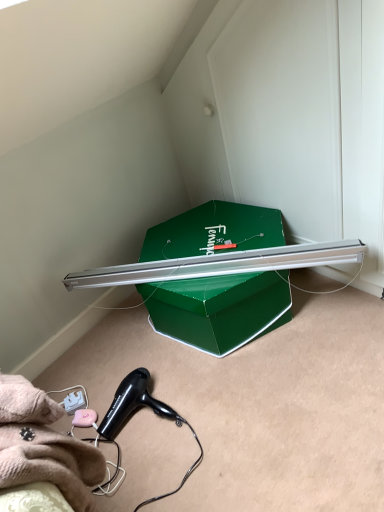
Question: Is black plastic hair dryer at lower left taller or shorter than green cardboard box at center?

Choices:
 (A) short
 (B) tall

Answer: (A)

Question: Considering the positions of black plastic hair dryer at lower left and green cardboard box at center in the image, is black plastic hair dryer at lower left bigger or smaller than green cardboard box at center?

Choices:
 (A) big
 (B) small

Answer: (B)

Question: Does point (157, 408) appear closer or farther from the camera than point (211, 209)?

Choices:
 (A) closer
 (B) farther

Answer: (A)

Question: From a real-world perspective, is green cardboard box at center above or below black plastic hair dryer at lower left?

Choices:
 (A) below
 (B) above

Answer: (B)

Question: From their relative heights in the image, would you say green cardboard box at center is taller or shorter than black plastic hair dryer at lower left?

Choices:
 (A) short
 (B) tall

Answer: (B)

Question: Choose the correct answer: Is green cardboard box at center inside black plastic hair dryer at lower left or outside it?

Choices:
 (A) inside
 (B) outside

Answer: (B)

Question: In the image, is green cardboard box at center positioned in front of or behind black plastic hair dryer at lower left?

Choices:
 (A) behind
 (B) front

Answer: (A)